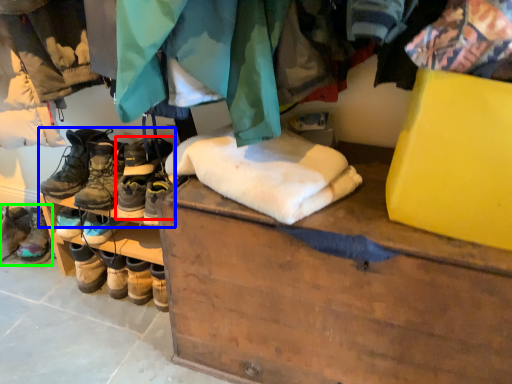
Question: Which object is the farthest from footwear (highlighted by a red box)? Choose among these: footwear (highlighted by a blue box) or footwear (highlighted by a green box).

Choices:
 (A) footwear
 (B) footwear

Answer: (B)